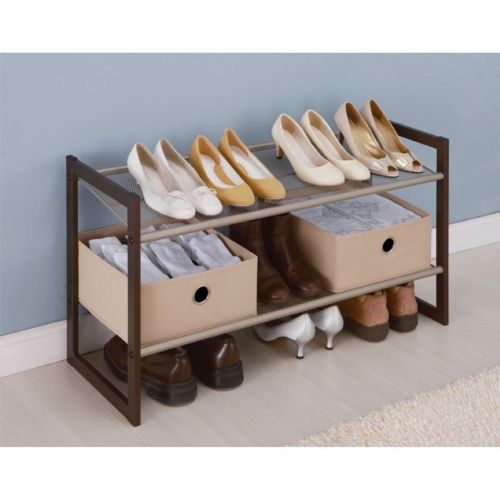
Locate an element on the screen. The image size is (500, 500). socks in box is located at coordinates (150, 269), (112, 251), (96, 248), (177, 257), (162, 239), (146, 226), (211, 251), (191, 235), (171, 224).